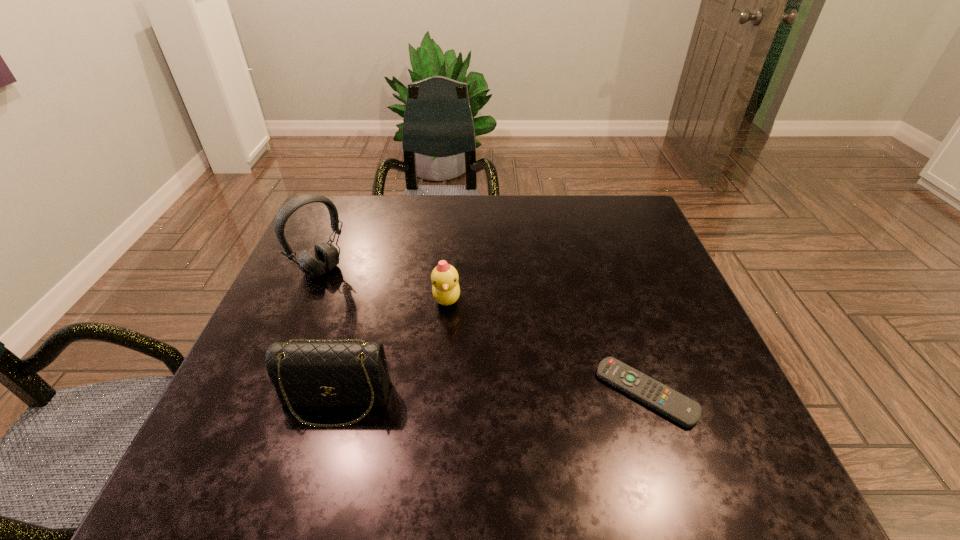
At what (x,y) coordinates should I click in order to perform the action: click on free space located 0.130m on the front-facing side of the tallest object. Please return your answer as a coordinate pair (x, y). This screenshot has width=960, height=540. Looking at the image, I should click on (366, 307).

I want to click on vacant space located on the front-facing side of the tallest object, so click(429, 360).

Locate an element on the screen. clutch bag situated at the near edge is located at coordinates (341, 373).

What are the coordinates of `remote control situated at the near edge` in the screenshot? It's located at (676, 406).

Where is `clutch bag that is at the left edge`? This screenshot has width=960, height=540. clutch bag that is at the left edge is located at coordinates (341, 373).

You are a GUI agent. You are given a task and a screenshot of the screen. Output one action in this format:
    pyautogui.click(x=<x>, y=<y>)
    Task: Click on the headset situated at the left edge
    The width and height of the screenshot is (960, 540).
    Given the screenshot: What is the action you would take?
    pyautogui.click(x=326, y=257)

You are a GUI agent. You are given a task and a screenshot of the screen. Output one action in this format:
    pyautogui.click(x=<x>, y=<y>)
    Task: Click on the object present at the right edge
    The width and height of the screenshot is (960, 540).
    Given the screenshot: What is the action you would take?
    pyautogui.click(x=676, y=406)

This screenshot has height=540, width=960. In order to click on object that is at the near left corner in this screenshot , I will do `click(341, 373)`.

The height and width of the screenshot is (540, 960). I want to click on object at the near right corner, so click(676, 406).

Locate an element on the screen. This screenshot has width=960, height=540. vacant space at the far edge of the desktop is located at coordinates (386, 228).